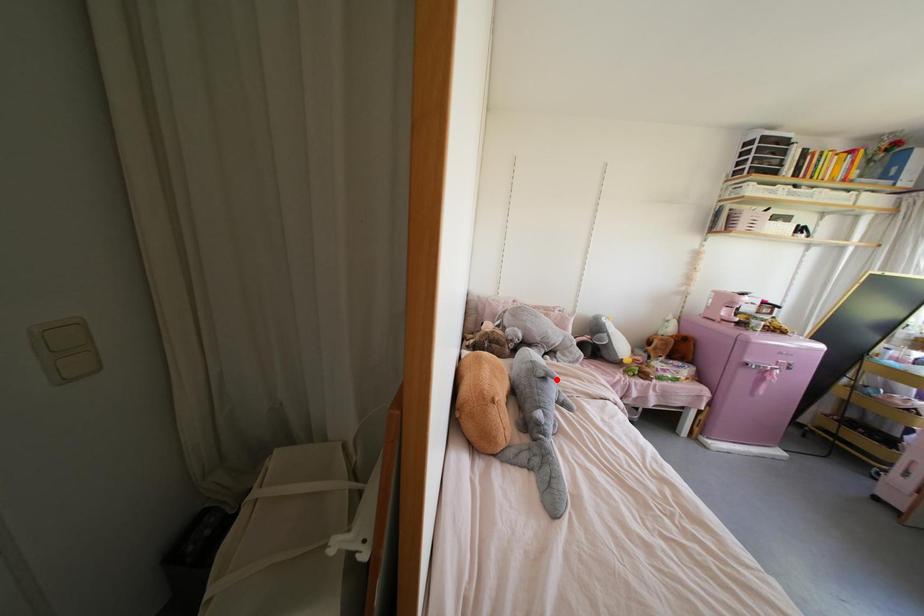
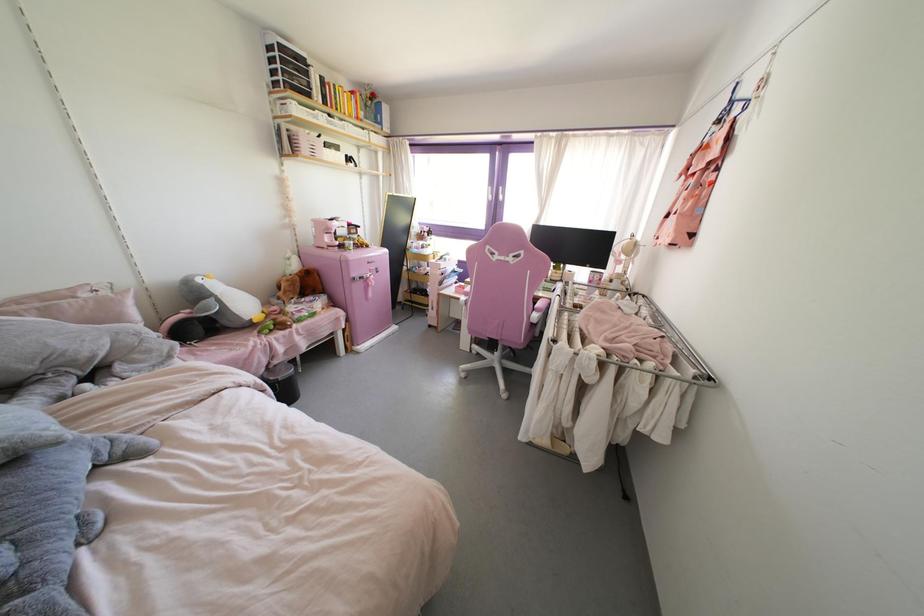
Question: I am providing you with two images of the same scene from different viewpoints. In image1, a red point is highlighted. Considering the same 3D point in image2, which of the following is correct?

Choices:
 (A) It is closer
 (B) It is farther

Answer: (A)